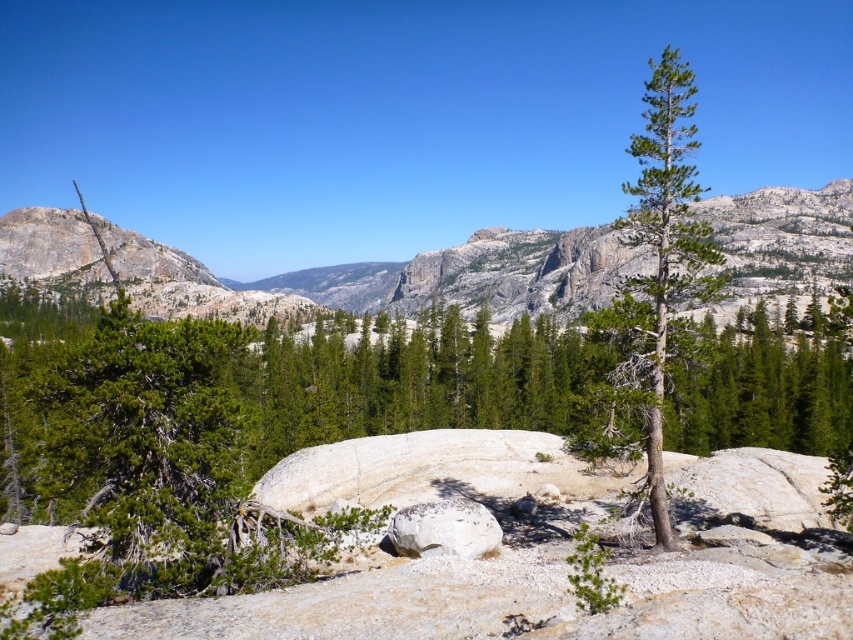
You are standing at the point marked as point (643, 227) in the mountain landscape. A hiker wants to know if they can see the small tree with sparse foliage on the right side of the rock formation from their current position. Can they?

The point marked as point (643, 227) is 121.32 feet away from the viewer. Since the small tree with sparse foliage on the right side of the rock formation is part of the foreground and within the viewer s line of sight, the hiker can see it from their current position.

You are a hiker trying to locate the granite rock formation at center on a map. According to the coordinates provided, where exactly is it situated?

The granite rock formation at center is situated at coordinates point (396, 275).

You are a geologist examining the mountain landscape. You notice a point marked at coordinates (396, 275). Based on the scene description, what geological feature does this point most likely indicate?

The point at coordinates (396, 275) marks the granite rock formation at center, which is a prominent geological feature in the mountainous landscape.